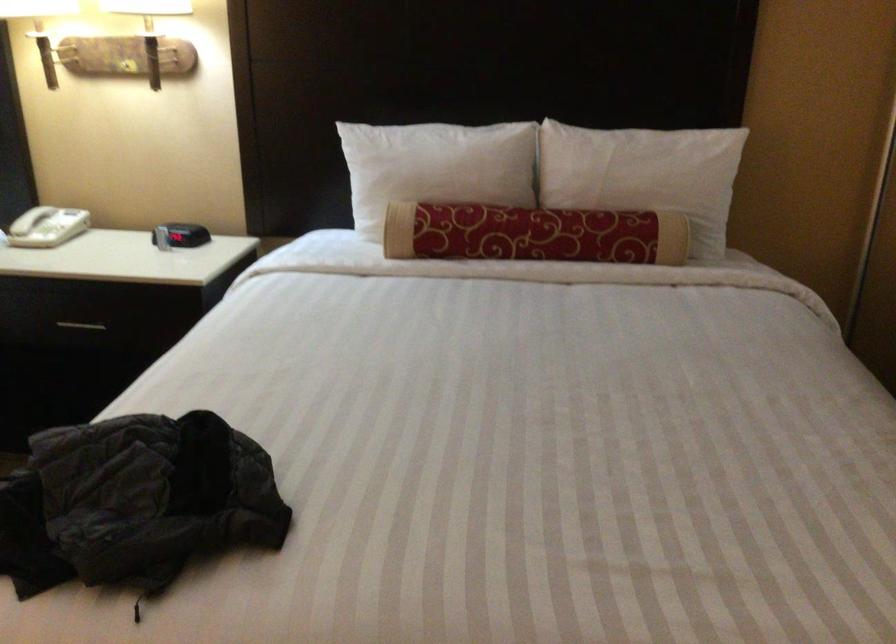
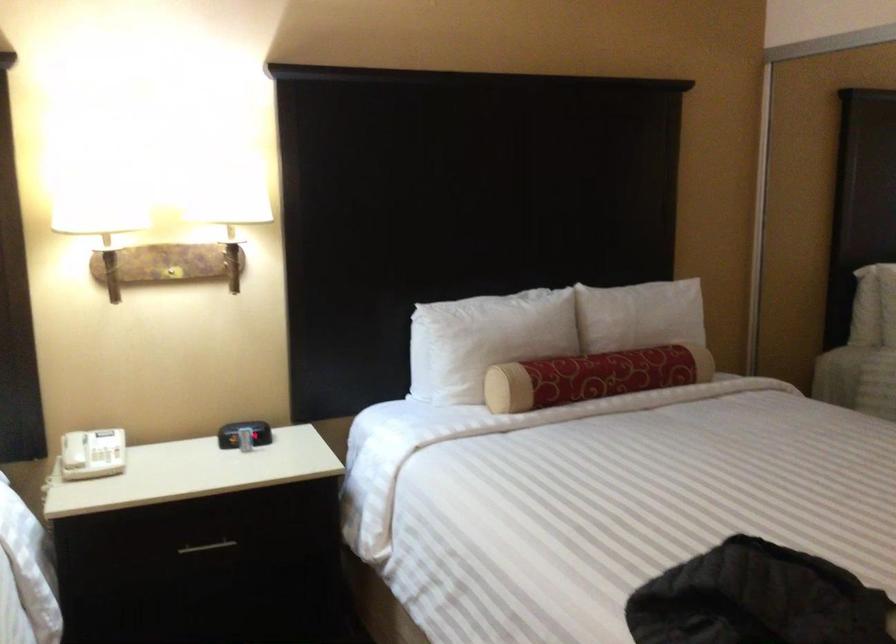
Where in the second image is the point corresponding to point (610, 176) from the first image?

(643, 319)